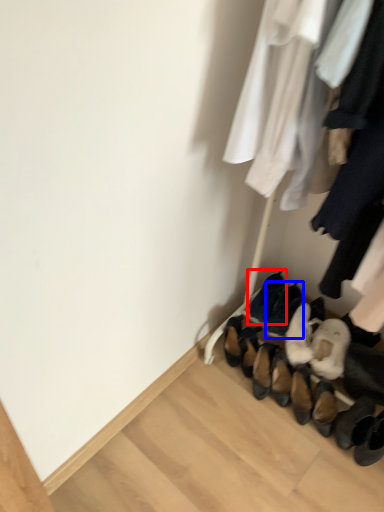
Question: Which object appears farthest to the camera in this image, footwear (highlighted by a red box) or footwear (highlighted by a blue box)?

Choices:
 (A) footwear
 (B) footwear

Answer: (A)